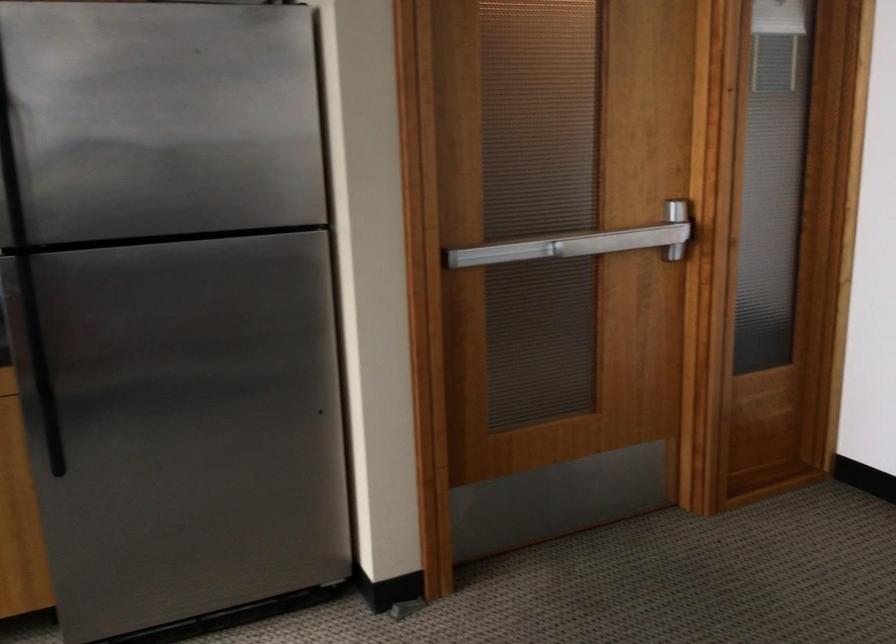
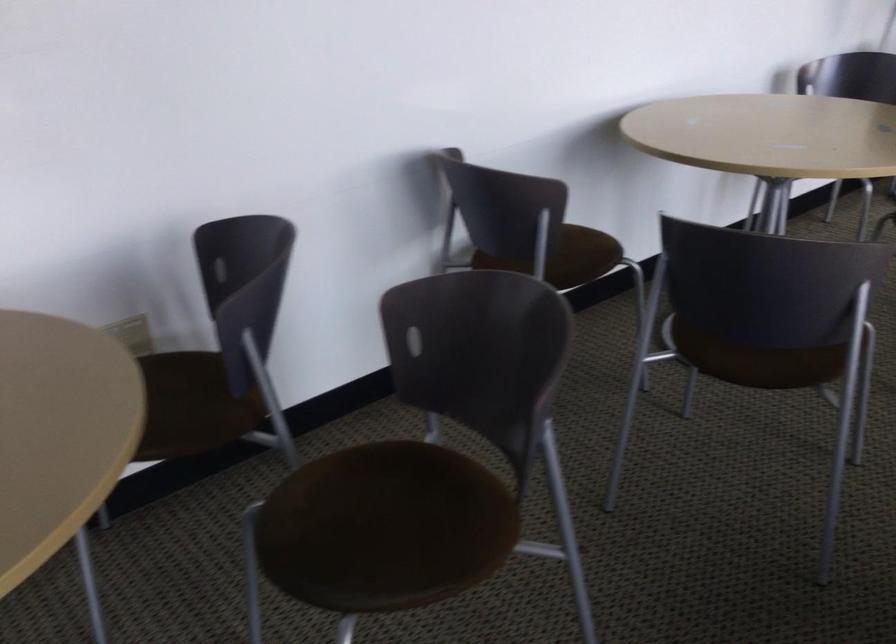
First-person continuous shooting, in which direction is the camera rotating?

The rotation direction of the camera is right-down.